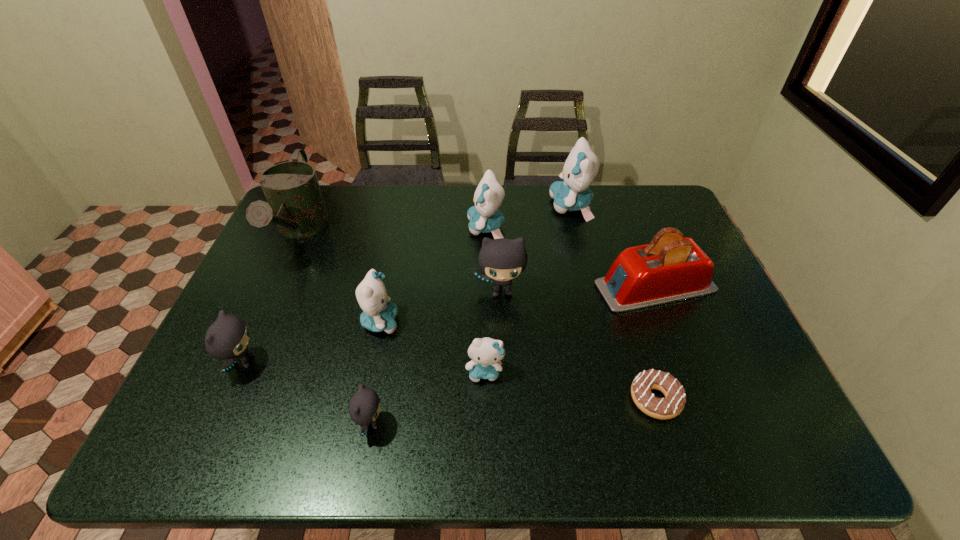
The image size is (960, 540). In the image, there is a desktop. What are the coordinates of `free space at the far right corner` in the screenshot? It's located at (667, 198).

Locate an element on the screen. The image size is (960, 540). vacant space that is in between the smallest blue kitten and the watering can is located at coordinates (393, 301).

In order to click on empty space between the third smallest blue kitten and the second gray kitten from right to left in this screenshot , I will do `click(428, 326)`.

Identify the location of free space between the smallest blue kitten and the second biggest gray kitten. (364, 367).

I want to click on vacant area that lies between the second gray kitten from right to left and the second nearest gray kitten, so [x=307, y=393].

Find the location of a particular element. This screenshot has width=960, height=540. free space between the third farthest kitten and the rightmost blue kitten is located at coordinates (537, 248).

You are a GUI agent. You are given a task and a screenshot of the screen. Output one action in this format:
    pyautogui.click(x=<x>, y=<y>)
    Task: Click on the free space between the nearest blue kitten and the second biggest blue kitten
    This screenshot has height=540, width=960.
    Given the screenshot: What is the action you would take?
    pyautogui.click(x=486, y=300)

At what (x,y) coordinates should I click in order to perform the action: click on vacant region between the second biggest blue kitten and the tallest kitten. Please return your answer as a coordinate pair (x, y). Image resolution: width=960 pixels, height=540 pixels. Looking at the image, I should click on (528, 217).

This screenshot has width=960, height=540. In order to click on unoccupied area between the leftmost kitten and the smallest gray kitten in this screenshot , I will do `click(307, 393)`.

Where is `free spot between the biggest blue kitten and the third farthest kitten`? The height and width of the screenshot is (540, 960). free spot between the biggest blue kitten and the third farthest kitten is located at coordinates (537, 248).